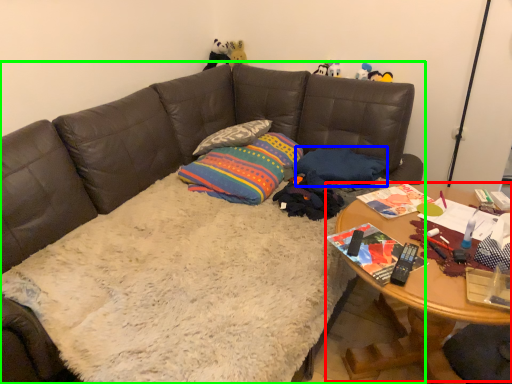
Question: Which is farther away from table (highlighted by a red box)? pillow (highlighted by a blue box) or studio couch (highlighted by a green box)?

Choices:
 (A) pillow
 (B) studio couch

Answer: (B)